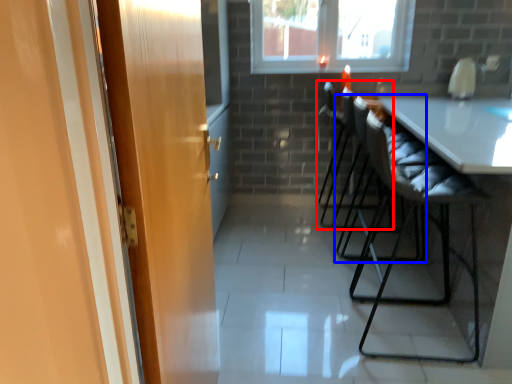
Question: Which object appears farthest to the camera in this image, chair (highlighted by a red box) or chair (highlighted by a blue box)?

Choices:
 (A) chair
 (B) chair

Answer: (A)